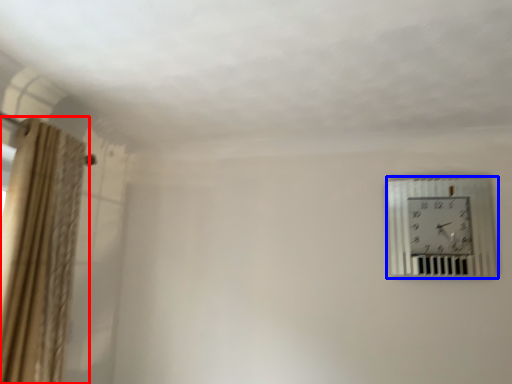
Question: Which of the following is the farthest to the observer, curtain (highlighted by a red box) or wall clock (highlighted by a blue box)?

Choices:
 (A) curtain
 (B) wall clock

Answer: (B)